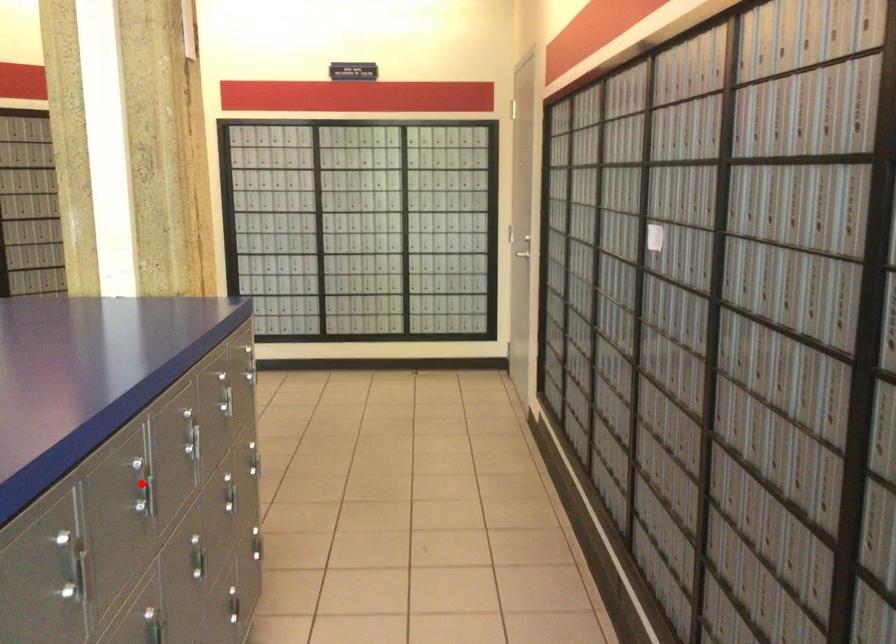
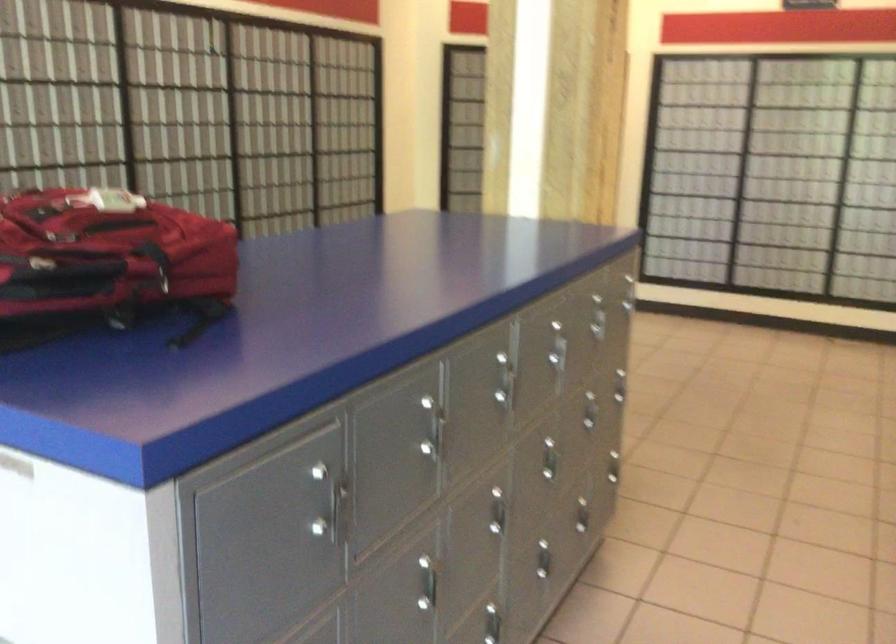
Question: A red point is marked in image1. In image2, is the corresponding 3D point closer to the camera or farther? Reply with the corresponding letter.

Choices:
 (A) The corresponding 3D point is closer.
 (B) The corresponding 3D point is farther.

Answer: (B)